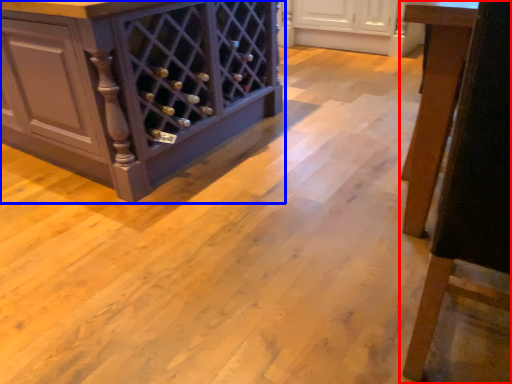
Question: Which of the following is the farthest to the observer, furniture (highlighted by a red box) or cabinetry (highlighted by a blue box)?

Choices:
 (A) furniture
 (B) cabinetry

Answer: (B)